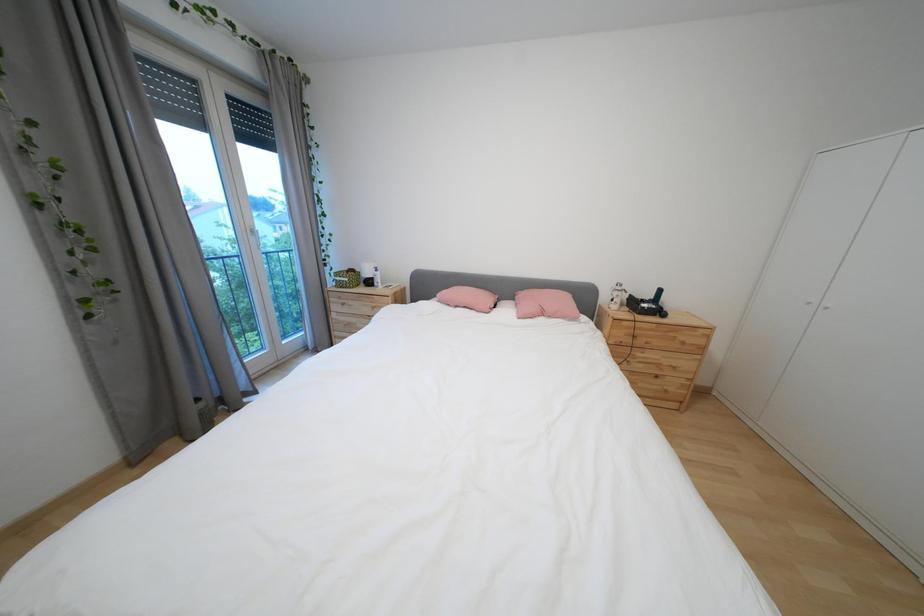
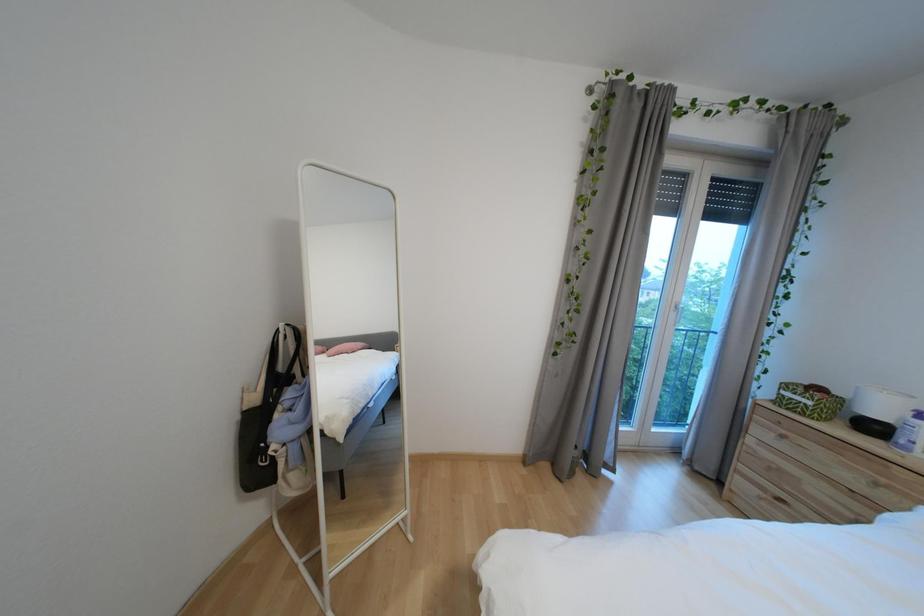
Question: How did the camera likely rotate?

Choices:
 (A) Left
 (B) Right
 (C) Up
 (D) Down

Answer: (A)